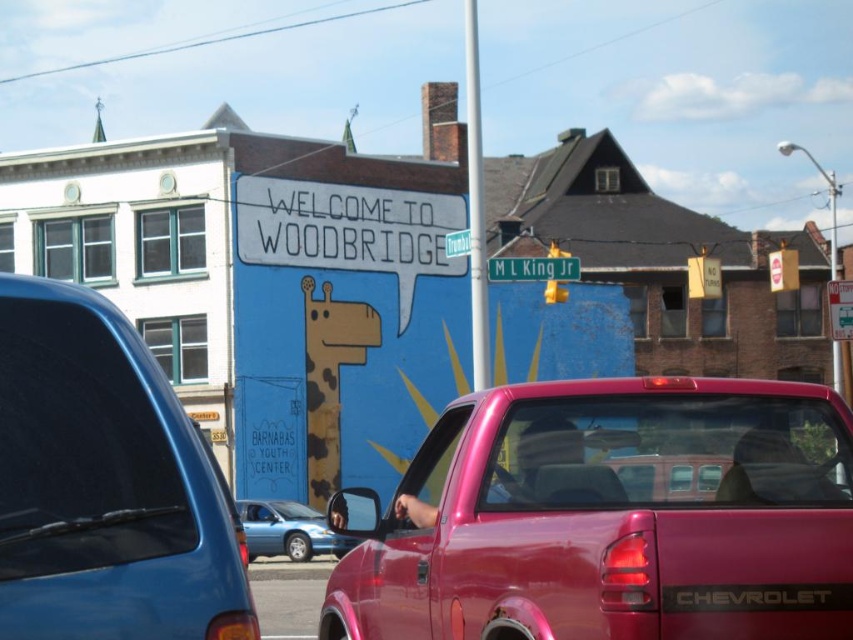
Can you confirm if metallic pink truck at center is positioned to the right of metallic blue sedan at center?

Correct, you'll find metallic pink truck at center to the right of metallic blue sedan at center.

Which is above, metallic pink truck at center or metallic blue sedan at center?

metallic pink truck at center

Identify the location of metallic pink truck at center. (608, 516).

This screenshot has width=853, height=640. What are the coordinates of `metallic pink truck at center` in the screenshot? It's located at (608, 516).

Consider the image. Is matte black van at left below green metallic street sign at center?

Yes.

Does point (48, 493) lie in front of point (524, 259)?

Yes, point (48, 493) is closer to viewer.

This screenshot has height=640, width=853. What do you see at coordinates (103, 483) in the screenshot?
I see `matte black van at left` at bounding box center [103, 483].

The width and height of the screenshot is (853, 640). Find the location of `matte black van at left`. matte black van at left is located at coordinates (103, 483).

Is metallic blue sedan at center smaller than green metallic street sign at center?

Actually, metallic blue sedan at center might be larger than green metallic street sign at center.

Who is more distant from viewer, (260, 541) or (575, 257)?

Positioned behind is point (260, 541).

Find the location of a particular element. The height and width of the screenshot is (640, 853). metallic blue sedan at center is located at coordinates (288, 531).